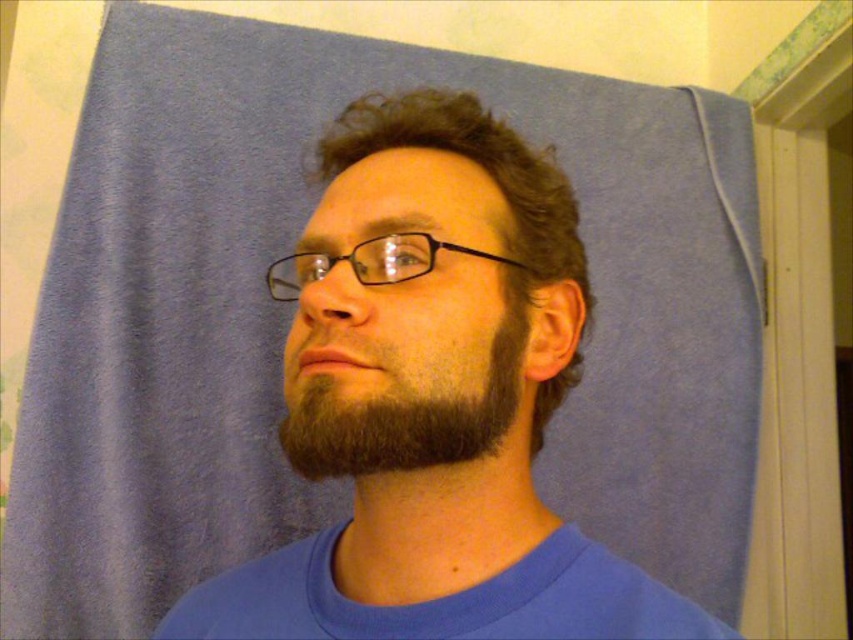
Question: Considering the real-world distances, which object is closest to the blue matte shirt at center?

Choices:
 (A) dark brown fuzzy beard at center
 (B) dark brown curly hair at center
 (C) black plastic glasses at center

Answer: (B)

Question: Estimate the real-world distances between objects in this image. Which object is farther from the black plastic glasses at center?

Choices:
 (A) blue matte shirt at center
 (B) dark brown curly hair at center

Answer: (A)

Question: Does blue matte shirt at center have a smaller size compared to dark brown fuzzy beard at center?

Choices:
 (A) no
 (B) yes

Answer: (A)

Question: Which point is closer to the camera taking this photo?

Choices:
 (A) [343, 426]
 (B) [370, 134]

Answer: (A)

Question: Observing the image, what is the correct spatial positioning of blue matte shirt at center in reference to dark brown curly hair at center?

Choices:
 (A) above
 (B) below

Answer: (B)

Question: Does dark brown curly hair at center have a larger size compared to black plastic glasses at center?

Choices:
 (A) yes
 (B) no

Answer: (A)